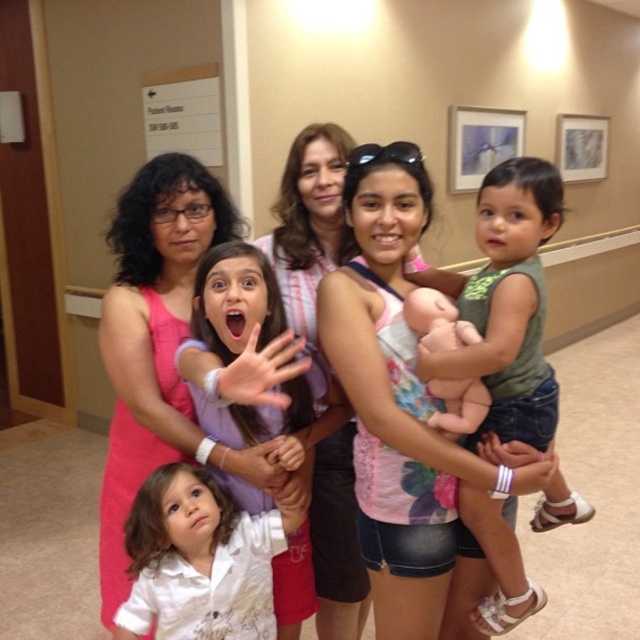
Between green fabric dress at center and soft pink fabric baby at center, which one has more height?

green fabric dress at center is taller.

Who is more forward, (506, 376) or (413, 321)?

Point (413, 321) is in front.

What are the coordinates of `green fabric dress at center` in the screenshot? It's located at 509,305.

This screenshot has height=640, width=640. Identify the location of pink floral tank top at center. (403, 417).

Is pink floral tank top at center positioned in front of green fabric dress at center?

No, it is not.

What do you see at coordinates (403, 417) in the screenshot? The height and width of the screenshot is (640, 640). I see `pink floral tank top at center` at bounding box center [403, 417].

I want to click on pink floral tank top at center, so click(403, 417).

Is matte purple shirt at center positioned at the back of soft pink fabric baby at center?

That is False.

Can you confirm if matte purple shirt at center is bigger than soft pink fabric baby at center?

Correct, matte purple shirt at center is larger in size than soft pink fabric baby at center.

Does point (205, 369) come in front of point (436, 340)?

Yes, point (205, 369) is in front of point (436, 340).

Where is `matte purple shirt at center`? matte purple shirt at center is located at coordinates (252, 360).